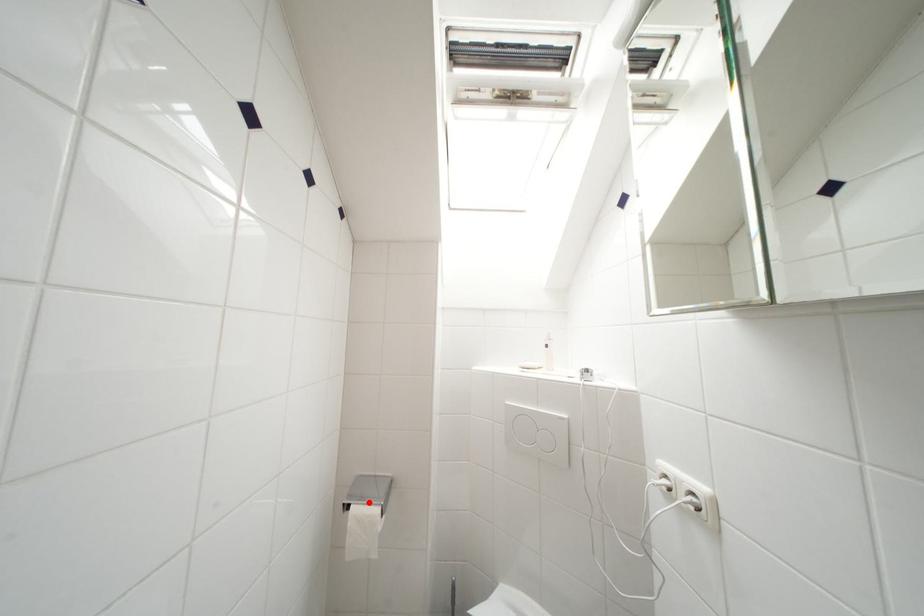
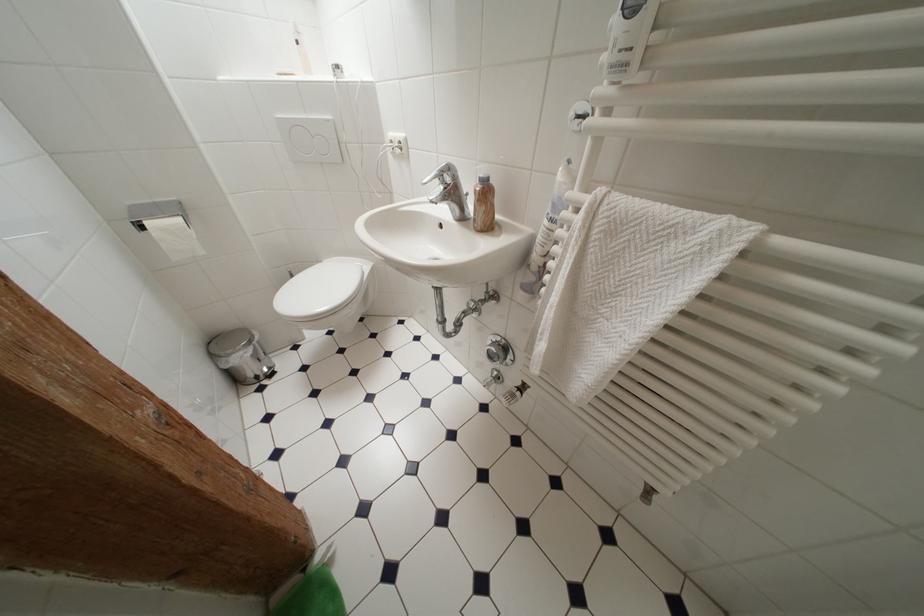
Locate, in the second image, the point that corresponds to the highlighted location in the first image.

(160, 219)